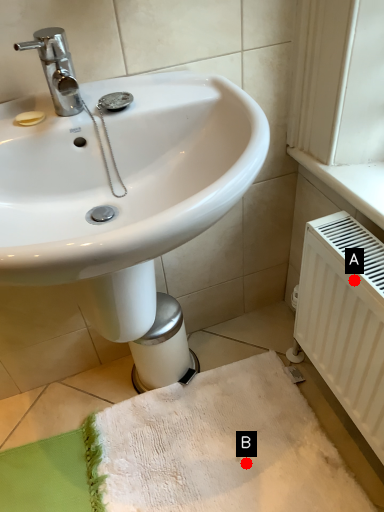
Question: Two points are circled on the image, labeled by A and B beside each circle. Which point appears farthest from the camera in this image?

Choices:
 (A) A is further
 (B) B is further

Answer: (B)